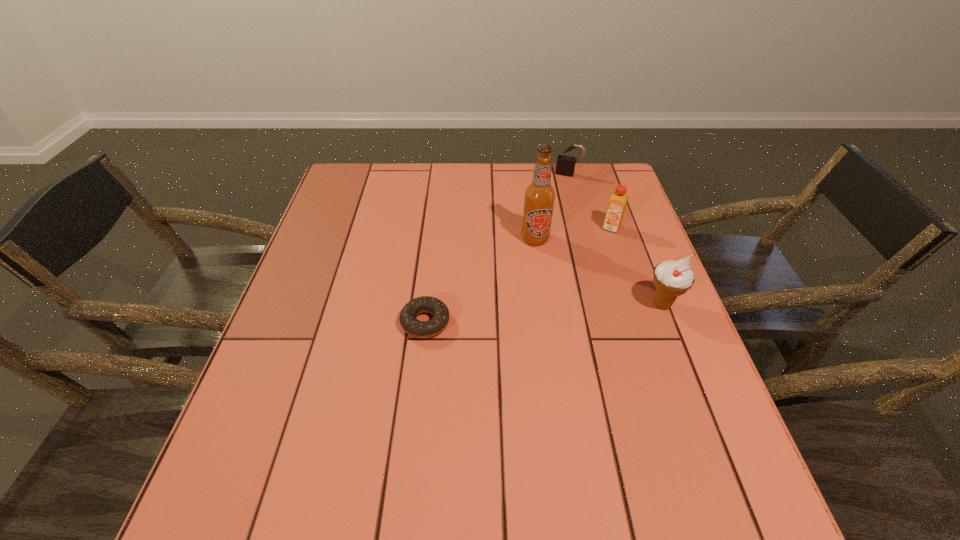
Where is `icecream at the right edge`? The height and width of the screenshot is (540, 960). icecream at the right edge is located at coordinates (671, 278).

Where is `orange juice that is at the right edge`? orange juice that is at the right edge is located at coordinates (617, 203).

Find the location of a particular element. padlock that is at the right edge is located at coordinates (565, 164).

Where is `object that is at the far right corner`? The image size is (960, 540). object that is at the far right corner is located at coordinates pyautogui.click(x=565, y=164).

The width and height of the screenshot is (960, 540). I want to click on free space at the far edge of the desktop, so click(x=394, y=172).

This screenshot has height=540, width=960. In the image, there is a desktop. Find the location of `vacant region at the near edge`. vacant region at the near edge is located at coordinates (418, 429).

This screenshot has width=960, height=540. In the image, there is a desktop. In order to click on vacant space at the left edge in this screenshot , I will do `click(249, 393)`.

I want to click on vacant space at the right edge, so click(641, 310).

Locate an element on the screen. The image size is (960, 540). vacant position at the far left corner of the desktop is located at coordinates (x=354, y=165).

In the image, there is a desktop. Where is `vacant space at the near left corner`? This screenshot has height=540, width=960. vacant space at the near left corner is located at coordinates (278, 453).